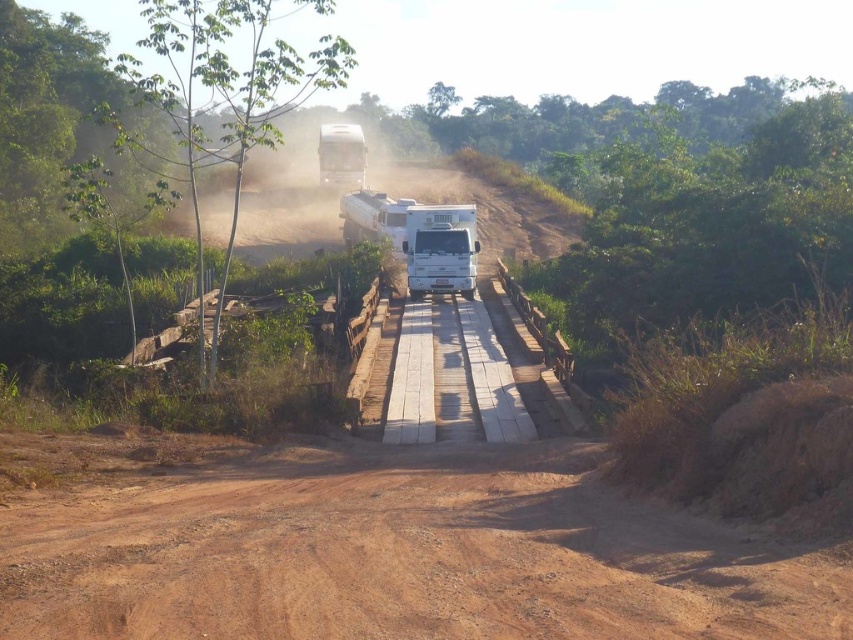
Can you confirm if brown dirt track at center is bigger than white matte recreational vehicle at center?

Yes.

Does brown dirt track at center appear on the left side of white matte recreational vehicle at center?

Indeed, brown dirt track at center is positioned on the left side of white matte recreational vehicle at center.

Is point (589, 445) in front of point (459, 209)?

That is True.

This screenshot has height=640, width=853. I want to click on brown dirt track at center, so click(x=397, y=554).

Measure the distance between white matte recreational vehicle at center and white matte truck at center.

The distance of white matte recreational vehicle at center from white matte truck at center is 26.58 meters.

Is point (438, 220) positioned after point (343, 172)?

No, (438, 220) is closer to viewer.

Does point (451, 253) come in front of point (328, 182)?

Yes, point (451, 253) is in front of point (328, 182).

Where is `white matte recreational vehicle at center`? The image size is (853, 640). white matte recreational vehicle at center is located at coordinates (440, 250).

Is brown dirt track at center bigger than white matte truck at center?

No, brown dirt track at center is not bigger than white matte truck at center.

Where is `brown dirt track at center`? The height and width of the screenshot is (640, 853). brown dirt track at center is located at coordinates (397, 554).

The image size is (853, 640). I want to click on brown dirt track at center, so click(397, 554).